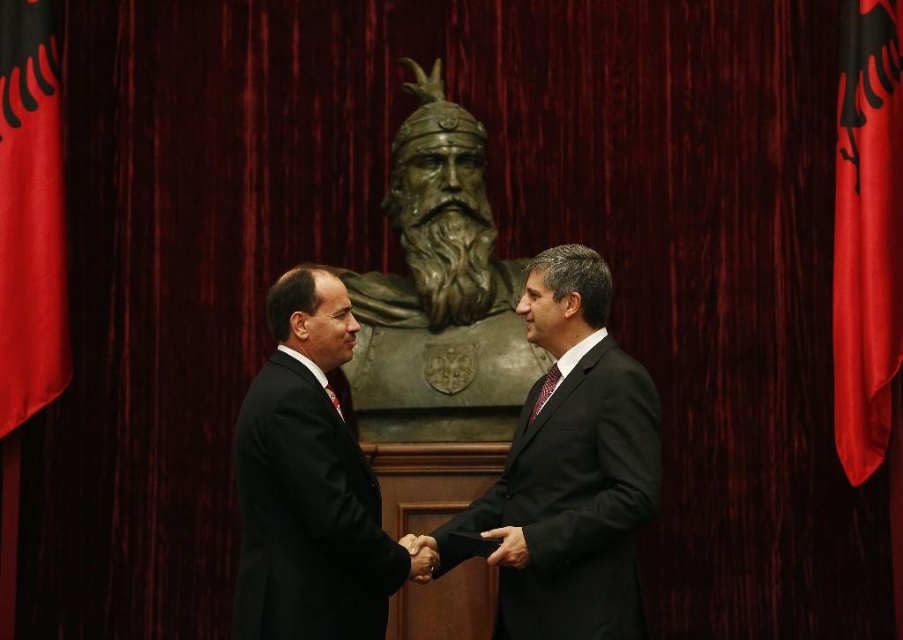
Between shiny bronze bust at center and smooth skin handshake at center, which one has more height?

With more height is shiny bronze bust at center.

Does shiny bronze bust at center have a lesser width compared to smooth skin handshake at center?

No, shiny bronze bust at center is not thinner than smooth skin handshake at center.

Between point (540, 460) and point (424, 557), which one is positioned behind?

The point (540, 460) is more distant.

This screenshot has height=640, width=903. I want to click on shiny bronze bust at center, so click(570, 468).

Does bronze bust at center have a greater width compared to smooth skin handshake at center?

Yes.

Who is taller, bronze bust at center or smooth skin handshake at center?

bronze bust at center is taller.

Which is in front, point (402, 404) or point (433, 570)?

Positioned in front is point (433, 570).

Identify the location of bronze bust at center. (439, 276).

Can you confirm if black suit at center is bigger than smooth skin handshake at center?

Correct, black suit at center is larger in size than smooth skin handshake at center.

Locate an element on the screen. black suit at center is located at coordinates (308, 483).